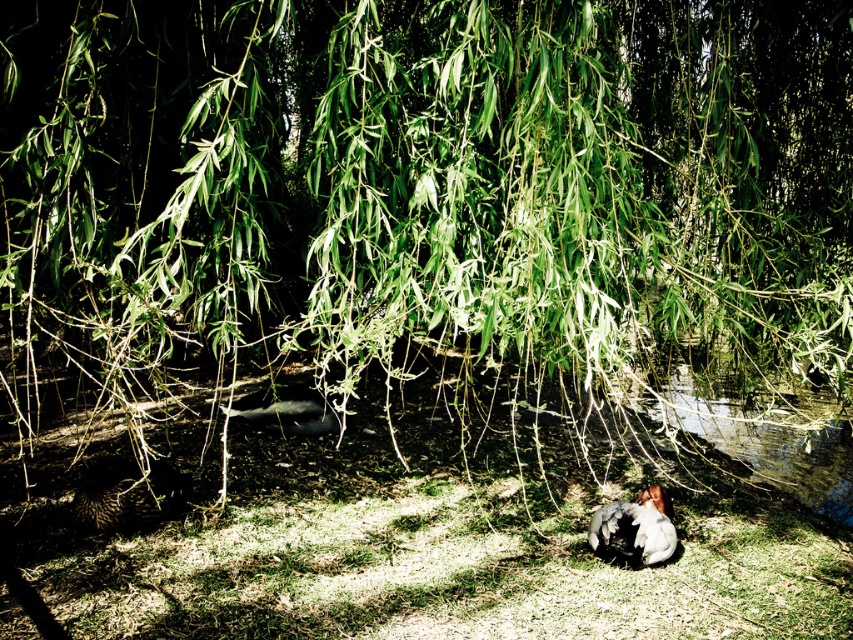
Which is behind, point (132, 470) or point (608, 509)?

Point (608, 509)

Can you confirm if brown speckled bird at lower left is smaller than speckled feathered bird at lower center?

Actually, brown speckled bird at lower left might be larger than speckled feathered bird at lower center.

Between point (152, 477) and point (592, 516), which one is positioned behind?

The point (592, 516) is behind.

Locate an element on the screen. brown speckled bird at lower left is located at coordinates (128, 496).

Locate an element on the screen. brown speckled bird at lower left is located at coordinates (128, 496).

Does brown speckled bird at lower left lie in front of brown fuzzy bird at center?

Yes, it is in front of brown fuzzy bird at center.

Does point (154, 486) come behind point (276, 428)?

No.

Identify the location of brown speckled bird at lower left. (128, 496).

Does point (599, 516) lie in front of point (300, 385)?

Yes, point (599, 516) is in front of point (300, 385).

Which is in front, point (666, 525) or point (283, 390)?

Point (666, 525) is more forward.

What are the coordinates of `speckled feathered bird at lower center` in the screenshot? It's located at (635, 525).